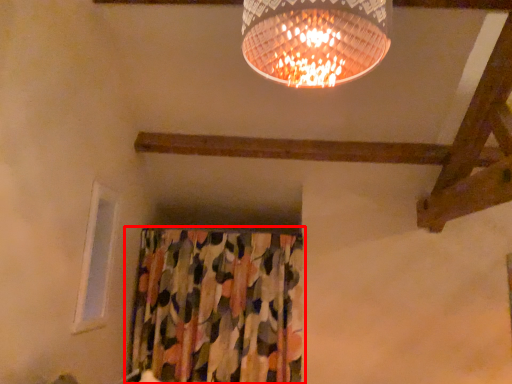
Question: From the image, what is the correct spatial relationship of curtain (annotated by the red box) in relation to window?

Choices:
 (A) right
 (B) left

Answer: (A)